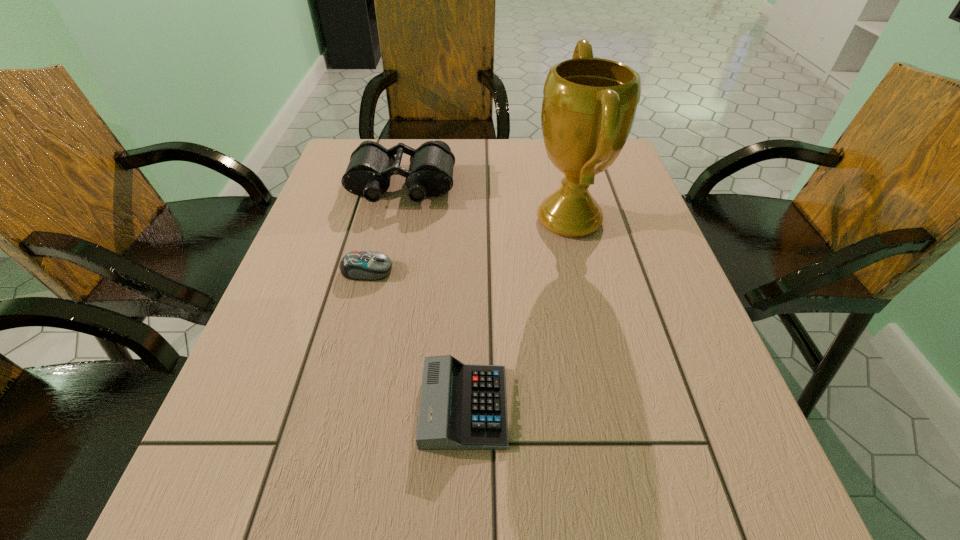
This screenshot has width=960, height=540. I want to click on vacant space situated 0.190m on the left of the nearest object, so click(304, 406).

Locate an element on the screen. The width and height of the screenshot is (960, 540). award at the far edge is located at coordinates (589, 105).

Where is `binoculars at the far edge`? binoculars at the far edge is located at coordinates (430, 174).

At what (x,y) coordinates should I click in order to perform the action: click on binoculars at the left edge. Please return your answer as a coordinate pair (x, y). The image size is (960, 540). Looking at the image, I should click on [x=430, y=174].

Find the location of a particular element. The height and width of the screenshot is (540, 960). computer mouse that is at the left edge is located at coordinates (x=358, y=265).

Where is `object at the right edge`? The width and height of the screenshot is (960, 540). object at the right edge is located at coordinates (589, 105).

What are the coordinates of `object at the far left corner` in the screenshot? It's located at (430, 174).

This screenshot has height=540, width=960. What are the coordinates of `object located in the far right corner section of the desktop` in the screenshot? It's located at (589, 105).

Where is `vacant space at the far edge`? The width and height of the screenshot is (960, 540). vacant space at the far edge is located at coordinates (495, 140).

This screenshot has height=540, width=960. What are the coordinates of `free region at the near edge` in the screenshot? It's located at (x=631, y=539).